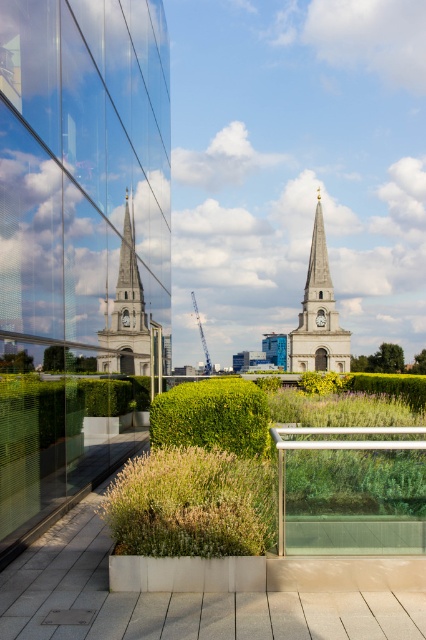
Question: Is white stone clock tower at center behind matte stone tower at center?

Choices:
 (A) no
 (B) yes

Answer: (B)

Question: Is the position of white stone church at center more distant than that of matte stone tower at center?

Choices:
 (A) no
 (B) yes

Answer: (A)

Question: Considering the relative positions of white stone church at center and green leafy hedge at center in the image provided, where is white stone church at center located with respect to green leafy hedge at center?

Choices:
 (A) below
 (B) above

Answer: (B)

Question: Which point is closer to the camera?

Choices:
 (A) (124, 339)
 (B) (317, 259)

Answer: (A)

Question: Which point appears farthest from the camera in this image?

Choices:
 (A) (307, 349)
 (B) (115, 323)

Answer: (A)

Question: Among these objects, which one is nearest to the camera?

Choices:
 (A) matte stone tower at center
 (B) green leafy hedge at center

Answer: (B)